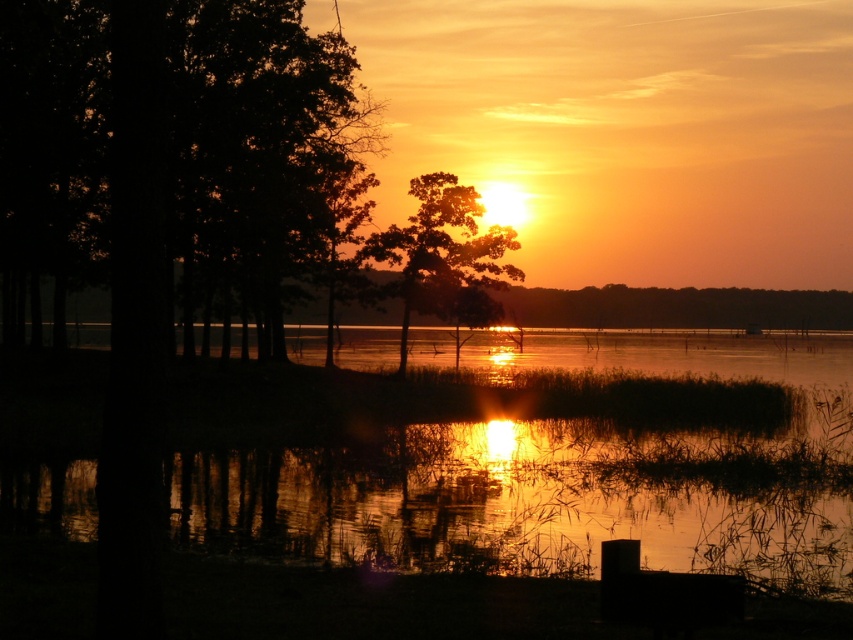
You are standing at the edge of the water and want to locate the glistening reflective water at center. According to the coordinates provided, where exactly should you look?

The glistening reflective water at center is located at coordinates point (x=560, y=472).

You are an observer standing at the edge of the water. You see the glistening reflective water at center and the silhouette tree at center. Which object is closer to the horizon?

The silhouette tree at center is closer to the horizon because the glistening reflective water at center is below it, indicating the tree is further away in the scene.

Looking at this image, you are an artist trying to paint the sunset scene. You notice the dark brown wood trees at left and the silhouette tree at center. Which of these two trees would you paint first to ensure proper layering in your artwork?

The silhouette tree at center should be painted first because the dark brown wood trees at left are larger and would likely be in front, so painting the smaller silhouette tree first allows the larger trees to be layered over them properly.